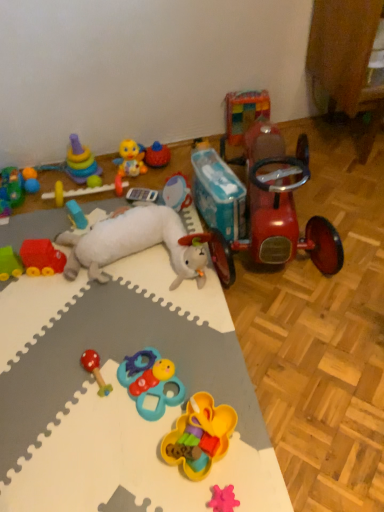
Where is `vacant area that lies between blue rubber rattle at center, the sixth toy positioned from the right, and wooden/matte rattle at lower left, marked as the 9th toy in a right-to-left arrangement`? The width and height of the screenshot is (384, 512). vacant area that lies between blue rubber rattle at center, the sixth toy positioned from the right, and wooden/matte rattle at lower left, marked as the 9th toy in a right-to-left arrangement is located at coordinates (124, 393).